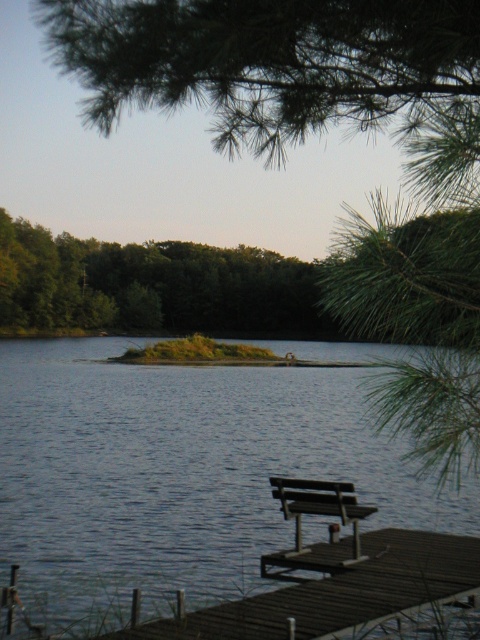
Is dark brown wood dock at lower right wider than wooden bench at lower right?

Yes, dark brown wood dock at lower right is wider than wooden bench at lower right.

Is point (420, 554) less distant than point (301, 496)?

Yes, point (420, 554) is in front of point (301, 496).

You are a GUI agent. You are given a task and a screenshot of the screen. Output one action in this format:
    pyautogui.click(x=<x>, y=<y>)
    Task: Click on the dark brown wood dock at lower right
    This screenshot has height=640, width=480.
    Given the screenshot: What is the action you would take?
    pyautogui.click(x=337, y=593)

Is point (0, 520) closer to viewer compared to point (300, 545)?

No, (0, 520) is further to viewer.

Can you confirm if dark blue water at center is shorter than wooden bench at lower right?

In fact, dark blue water at center may be taller than wooden bench at lower right.

Find the location of a particular element. dark blue water at center is located at coordinates (177, 474).

Which is below, green needle-like leaves at upper center or green leafy tree at center?

green needle-like leaves at upper center

Who is more forward, (120,99) or (0,282)?

Point (120,99) is in front.

Is point (66, 20) positioned in front of point (182, 317)?

Yes.

The image size is (480, 640). Find the location of `green needle-like leaves at upper center`. green needle-like leaves at upper center is located at coordinates (288, 72).